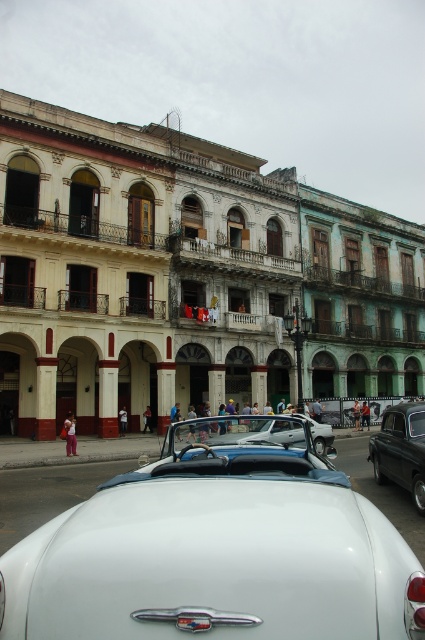
You are a photographer standing in the street and want to take a picture of both the white glossy car at center and the shiny black car at right. Since you want both cars to be in the frame, which car should you focus on first to ensure both are in the shot?

The white glossy car at center is located above the shiny black car at right, so you should focus on the white glossy car at center first to ensure both are in the frame.

You are a photographer planning to take a picture of the white glossy convertible at center and the shiny black car at right. You want to ensure both cars are fully visible in the frame. Based on their positions, which car is blocking the view of the other?

The white glossy convertible at center is positioned under the shiny black car at right, so the shiny black car at right is blocking the view of the white glossy convertible at center.